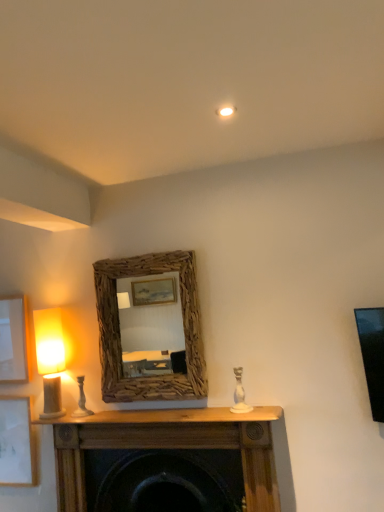
Question: Considering the relative positions of white ceramic candle holder at left, marked as the 2th candle holder in a front-to-back arrangement, and matte white picture frame at left, the 2th picture frame ordered from the bottom, in the image provided, is white ceramic candle holder at left, marked as the 2th candle holder in a front-to-back arrangement, to the left or to the right of matte white picture frame at left, the 2th picture frame ordered from the bottom,?

Choices:
 (A) left
 (B) right

Answer: (B)

Question: Is white ceramic candle holder at left, the first candle holder in the left-to-right sequence, in front of or behind matte white picture frame at left, the 1th picture frame from the top, in the image?

Choices:
 (A) front
 (B) behind

Answer: (A)

Question: Based on their relative distances, which object is nearer to the white ceramic candle holder at center, which is counted as the 2th candle holder, starting from the left?

Choices:
 (A) white matte picture frame at lower left, which is the 1th picture frame from bottom to top
 (B) matte beige lampshade at left
 (C) matte white picture frame at left, the 1th picture frame from the top
 (D) wooden mantel at center
 (E) driftwood mirror at center

Answer: (D)

Question: Which of these objects is positioned farthest from the matte white picture frame at left, the 1th picture frame from the top?

Choices:
 (A) driftwood mirror at center
 (B) wooden mantel at center
 (C) white ceramic candle holder at center, arranged as the first candle holder when viewed from the right
 (D) matte beige lampshade at left
 (E) white matte picture frame at lower left, which is counted as the second picture frame, starting from the top

Answer: (C)